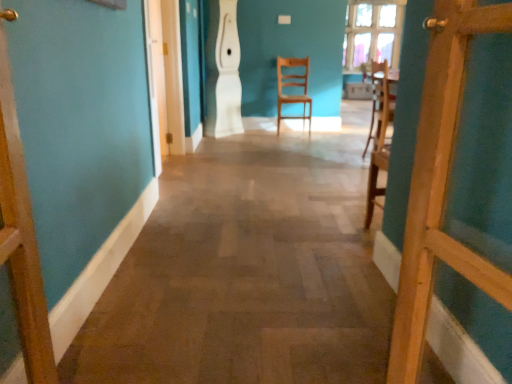
Question: Is wooden floor at center at the left side of wooden chair at right, the 2th chair viewed from the back?

Choices:
 (A) yes
 (B) no

Answer: (A)

Question: From the image's perspective, would you say wooden floor at center is positioned over wooden chair at right, placed as the second chair when sorted from left to right?

Choices:
 (A) yes
 (B) no

Answer: (B)

Question: Does wooden floor at center have a lesser height compared to wooden chair at right, the first chair viewed from the right?

Choices:
 (A) yes
 (B) no

Answer: (A)

Question: From the image's perspective, is wooden floor at center below wooden chair at right, the first chair viewed from the right?

Choices:
 (A) yes
 (B) no

Answer: (A)

Question: Is wooden floor at center positioned in front of wooden chair at right, the 1th chair positioned from the front?

Choices:
 (A) yes
 (B) no

Answer: (A)

Question: Can you confirm if wooden floor at center is bigger than wooden chair at right, the first chair viewed from the right?

Choices:
 (A) yes
 (B) no

Answer: (A)

Question: From a real-world perspective, does wooden chair at right, the 1th chair positioned from the front, stand above wooden door at right?

Choices:
 (A) yes
 (B) no

Answer: (B)

Question: Is wooden chair at right, the 2th chair viewed from the back, positioned behind wooden door at right?

Choices:
 (A) no
 (B) yes

Answer: (B)

Question: From the image's perspective, is wooden chair at right, the 2th chair viewed from the back, below wooden door at right?

Choices:
 (A) yes
 (B) no

Answer: (B)

Question: Can you confirm if wooden chair at right, the first chair viewed from the right, is thinner than wooden door at right?

Choices:
 (A) no
 (B) yes

Answer: (A)

Question: Is wooden chair at right, the 1th chair positioned from the front, with wooden door at right?

Choices:
 (A) no
 (B) yes

Answer: (A)

Question: Can you confirm if wooden chair at right, placed as the second chair when sorted from left to right, is positioned to the left of wooden door at right?

Choices:
 (A) yes
 (B) no

Answer: (B)

Question: Does wooden floor at center have a larger size compared to clear glass window at upper center?

Choices:
 (A) yes
 (B) no

Answer: (A)